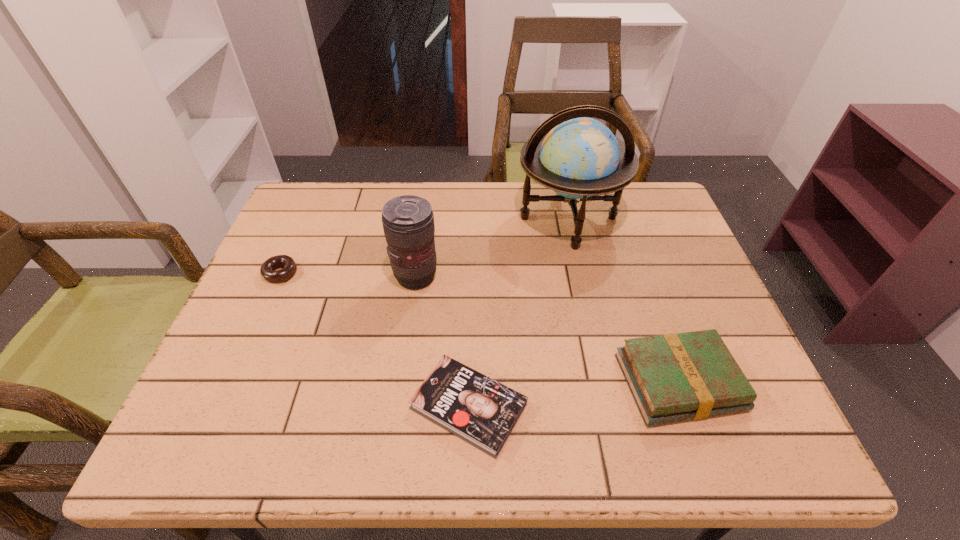
Locate an element on the screen. The width and height of the screenshot is (960, 540). vacant space located 0.140m on the left of the third tallest object is located at coordinates (553, 382).

Identify the location of vacant space located 0.320m on the right of the doughnut. This screenshot has height=540, width=960. (421, 273).

You are a GUI agent. You are given a task and a screenshot of the screen. Output one action in this format:
    pyautogui.click(x=<x>, y=<y>)
    Task: Click on the vacant position located 0.100m on the right of the shorter book
    
    Given the screenshot: What is the action you would take?
    pyautogui.click(x=578, y=407)

At what (x,y) coordinates should I click in order to perform the action: click on object at the far edge. Please return your answer as a coordinate pair (x, y). Looking at the image, I should click on (x=579, y=158).

Where is `object that is at the left edge`? This screenshot has width=960, height=540. object that is at the left edge is located at coordinates (289, 266).

This screenshot has width=960, height=540. Find the location of `globe that is at the right edge`. globe that is at the right edge is located at coordinates (579, 158).

Locate an element on the screen. book located at the right edge is located at coordinates (675, 377).

Identify the location of object present at the far right corner. (579, 158).

Locate an element on the screen. This screenshot has height=540, width=960. object that is at the near right corner is located at coordinates (675, 377).

Where is `free space at the far edge of the desktop`? The height and width of the screenshot is (540, 960). free space at the far edge of the desktop is located at coordinates (521, 203).